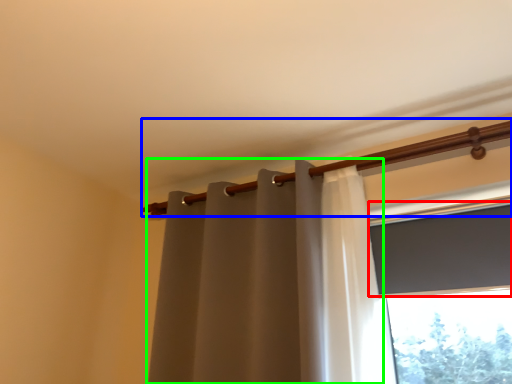
Question: Which object is positioned closest to window screen (highlighted by a red box)? Select from beam (highlighted by a blue box) and curtain (highlighted by a green box).

Choices:
 (A) beam
 (B) curtain

Answer: (A)